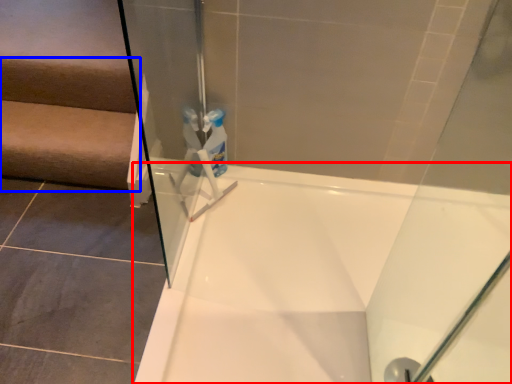
Question: Which object appears farthest to the camera in this image, bathtub (highlighted by a red box) or stairwell (highlighted by a blue box)?

Choices:
 (A) bathtub
 (B) stairwell

Answer: (B)